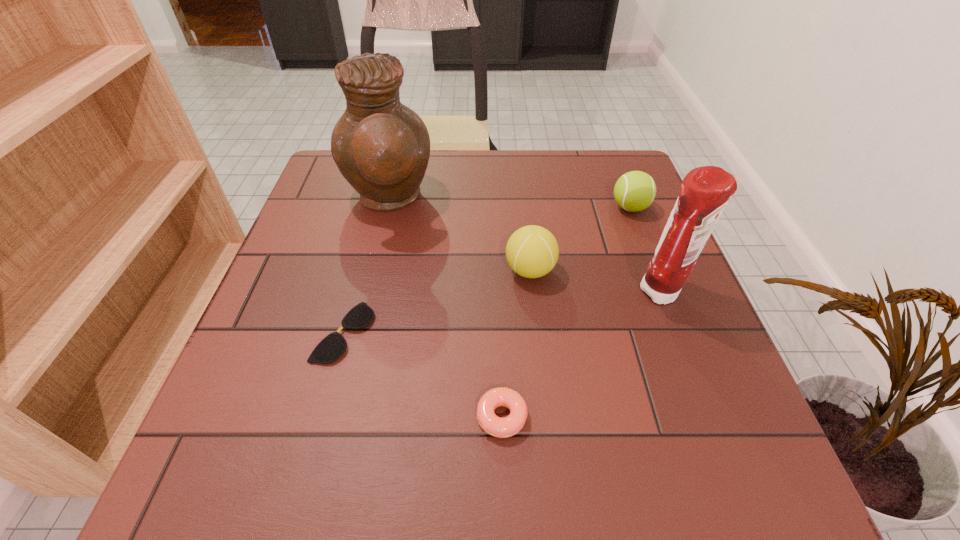
The height and width of the screenshot is (540, 960). What are the coordinates of `the tallest object` in the screenshot? It's located at (381, 147).

Image resolution: width=960 pixels, height=540 pixels. What are the coordinates of `condiment` in the screenshot? It's located at (705, 191).

Image resolution: width=960 pixels, height=540 pixels. Identify the location of the nearer tennis ball. (532, 251).

Identify the location of the right tennis ball. (634, 191).

You are a GUI agent. You are given a task and a screenshot of the screen. Output one action in this format:
    pyautogui.click(x=<x>, y=<y>)
    Task: Click on the nearest object
    This screenshot has width=960, height=540.
    Given the screenshot: What is the action you would take?
    pyautogui.click(x=496, y=426)

Find the location of `doughnut`. doughnut is located at coordinates (496, 426).

This screenshot has width=960, height=540. What are the coordinates of `the shortest object` in the screenshot? It's located at (331, 348).

Locate an element on the screen. vacant space situated 0.280m at the spout of the tallest object is located at coordinates (544, 199).

You are a GUI agent. You are given a task and a screenshot of the screen. Output one action in this format:
    pyautogui.click(x=<x>, y=<y>)
    Task: Click on the free space located 0.290m on the back of the condiment
    This screenshot has height=540, width=960.
    Given the screenshot: What is the action you would take?
    pyautogui.click(x=624, y=194)

Locate an element on the screen. The height and width of the screenshot is (540, 960). vacant space situated on the back of the left tennis ball is located at coordinates (526, 238).